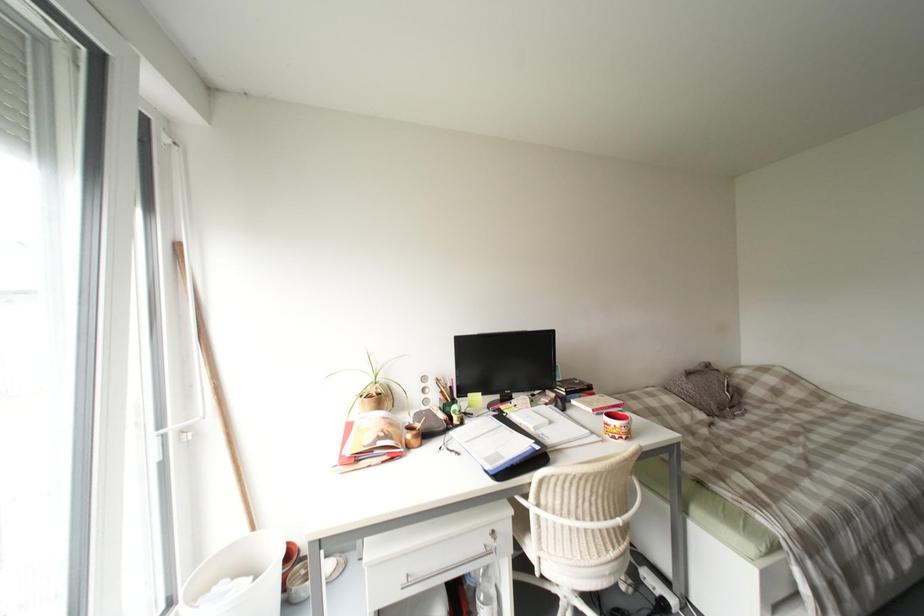
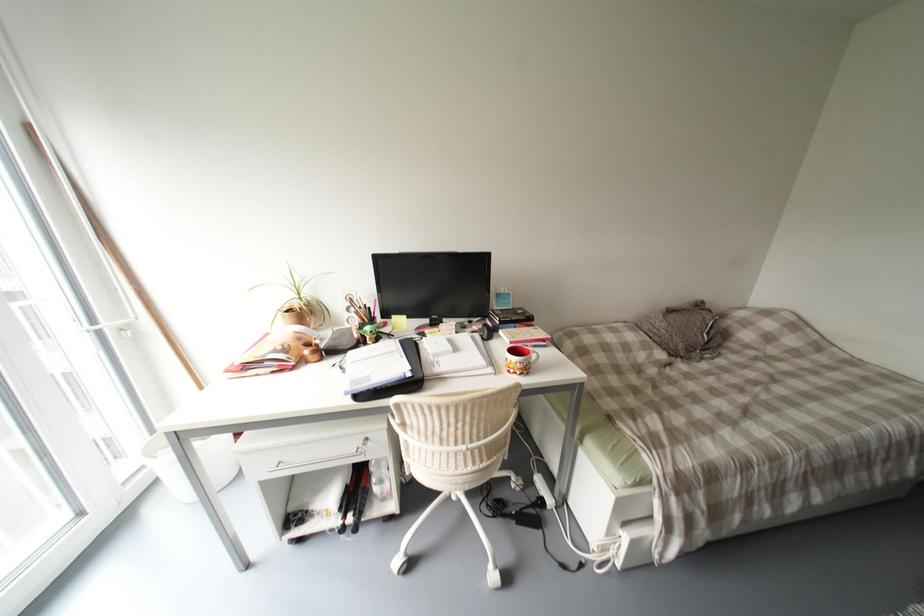
Question: Based on the continuous images, in which direction is the camera rotating? Reply with the corresponding letter.

Choices:
 (A) Left
 (B) Right
 (C) Up
 (D) Down

Answer: (D)